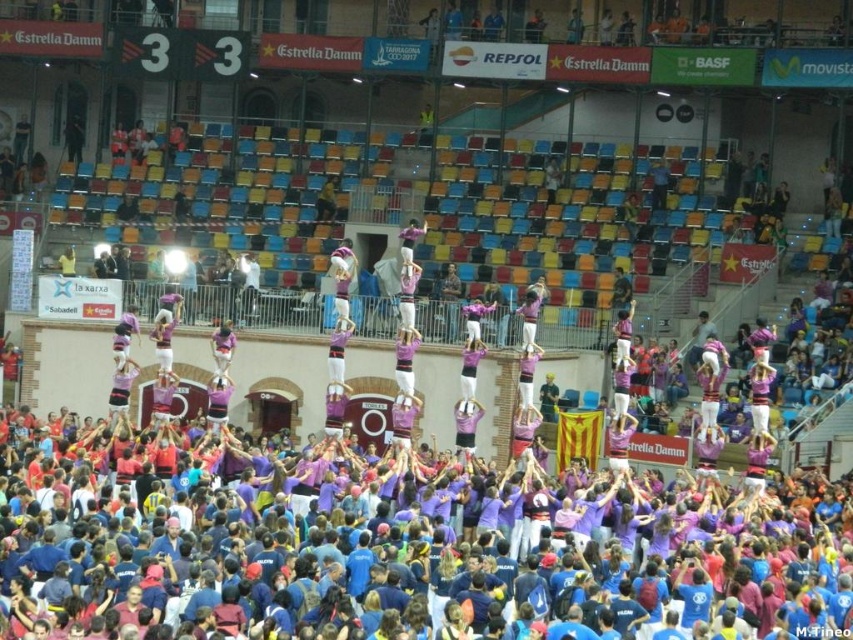
Does pink fabric person at center appear over purple fabric person at center?

No.

Does pink fabric person at center have a larger size compared to purple fabric person at center?

No, pink fabric person at center is not bigger than purple fabric person at center.

Is point (340, 365) positioned before point (222, 326)?

Yes.

Locate an element on the screen. pink fabric person at center is located at coordinates (338, 355).

Does purple cotton crowd at center have a lesser width compared to purple fabric at center?

Incorrect, purple cotton crowd at center's width is not less than purple fabric at center's.

Between point (83, 609) and point (412, 330), which one is positioned in front?

Point (83, 609)

Locate an element on the screen. Image resolution: width=853 pixels, height=640 pixels. purple cotton crowd at center is located at coordinates (416, 557).

Between pink fabric person at center and purple fabric human at center, which one has more height?

With more height is purple fabric human at center.

Can you confirm if pink fabric person at center is positioned below purple fabric human at center?

Yes.

Identify the location of pink fabric person at center. (338, 355).